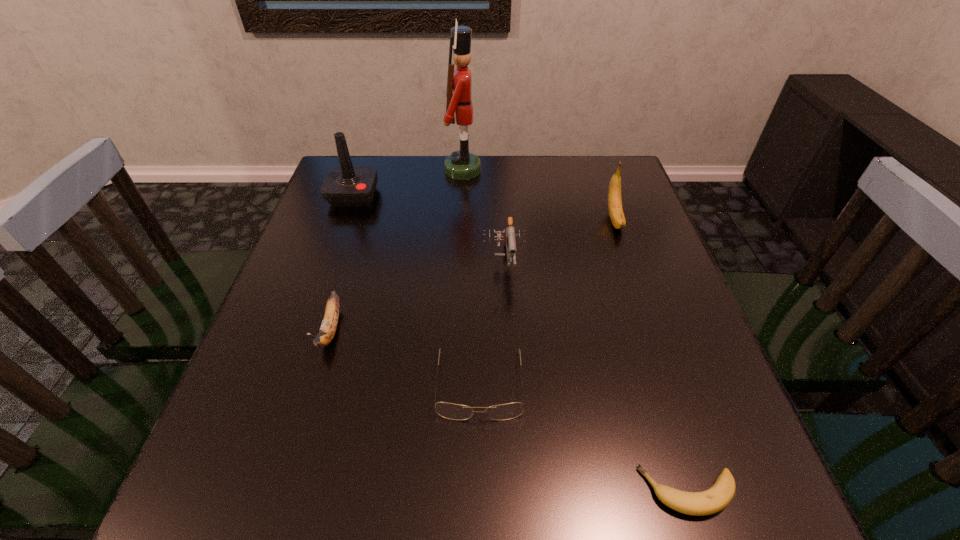
In the image, there is a desktop. Where is `vacant space at the left edge`? The height and width of the screenshot is (540, 960). vacant space at the left edge is located at coordinates (315, 207).

This screenshot has height=540, width=960. I want to click on vacant region at the right edge of the desktop, so click(667, 328).

Image resolution: width=960 pixels, height=540 pixels. What are the coordinates of `free space at the far left corner` in the screenshot? It's located at (385, 158).

The height and width of the screenshot is (540, 960). I want to click on vacant space at the far right corner of the desktop, so click(598, 172).

I want to click on vacant area that lies between the nearest banana and the gun, so click(x=596, y=377).

The height and width of the screenshot is (540, 960). I want to click on free space that is in between the nearest object and the spectacles, so click(584, 438).

Identify the location of free space that is in between the spectacles and the farthest object. (471, 278).

You are a GUI agent. You are given a task and a screenshot of the screen. Output one action in this format:
    pyautogui.click(x=<x>, y=<y>)
    Task: Click on the vacant area that lies between the second tallest banana and the gun
    This screenshot has height=540, width=960.
    Given the screenshot: What is the action you would take?
    pyautogui.click(x=418, y=296)

Locate an element on the screen. This screenshot has height=540, width=960. empty space between the spectacles and the farthest object is located at coordinates (471, 278).

Identify the location of empty space between the shortest object and the nutcracker. The width and height of the screenshot is (960, 540). (576, 331).